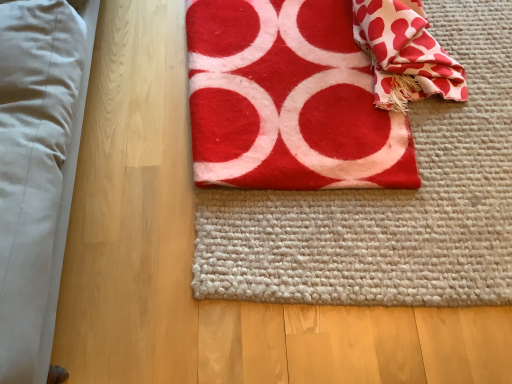
I want to click on free spot to the right of white textured fabric at upper right, so click(x=480, y=46).